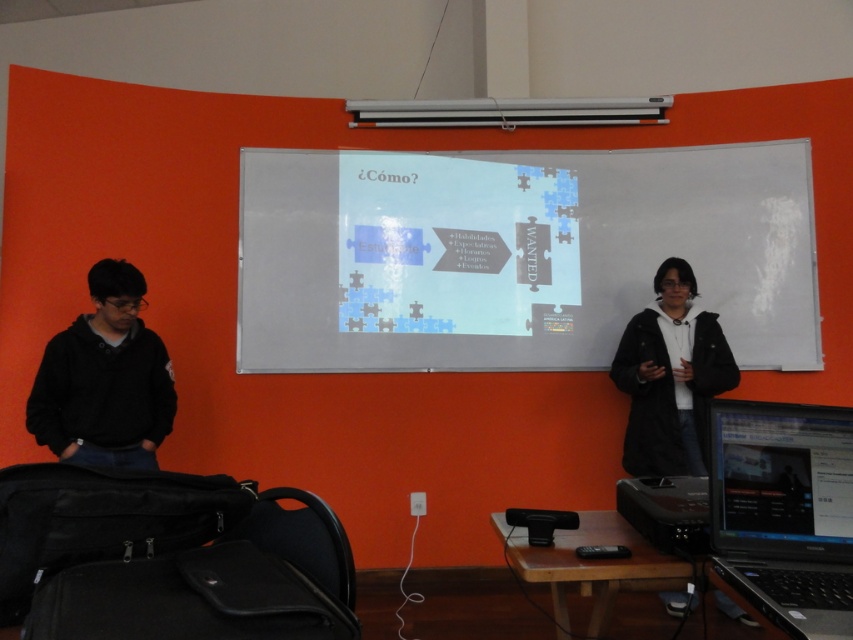
You are setting up a classroom for a presentation. The white matte projection screen at center needs to be positioned so that it doesn not block the black hoodie at left. Based on their sizes, is this possible?

The white matte projection screen at center might be wider than black hoodie at left, so positioning it without blocking may require careful placement to ensure the screen does not cover the hoodie.

You are a student in the classroom and need to present using the white matte projection screen at center. However, your black hoodie at left is blocking the screen. Can you still present effectively?

The white matte projection screen at center is larger in size than the black hoodie at left, so the screen is bigger and likely not fully blocked by the hoodie. You can still present effectively.

You are a student who needs to place a book on top of the silver metallic laptop at lower right and the black hoodie at left. Which object can the book be placed on without falling off?

The book can be placed on the black hoodie at left because the silver metallic laptop at lower right has a lesser height compared to black hoodie at left, making the hoodie a more stable surface.